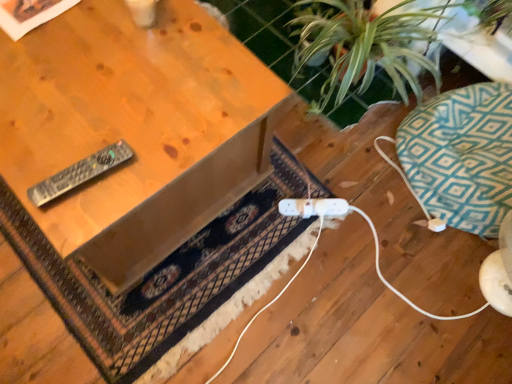
This screenshot has width=512, height=384. I want to click on blank space situated above wooden table at upper left (from a real-world perspective), so click(x=97, y=80).